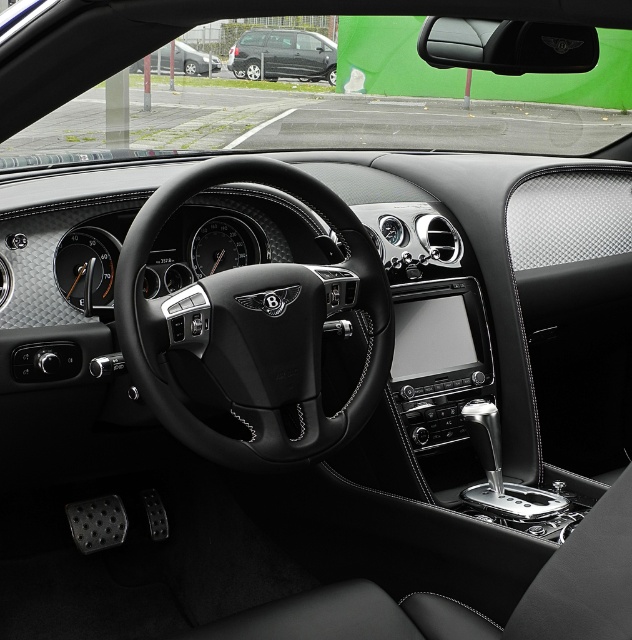
You are a passenger in a car and want to know what is located at the exact center of the dashboard. According to the image, what object is precisely at the point marked as point (283, 54)?

The point (283, 54) is occupied by a matte black van at center.

You are a car designer reviewing the Bentley interior image. You need to compare the sizes of the black leather steering wheel at center and the matte black car at upper left. Which object is wider?

The black leather steering wheel at center is wider than the matte black car at upper left according to the description.

You are sitting in the driver seat of the luxury vehicle and want to adjust the steering wheel controls. Which object, the black leather steering wheel at center or the matte black van at center, is positioned lower and thus easier to reach?

The black leather steering wheel at center is below the matte black van at center, so it is positioned lower and easier to reach.